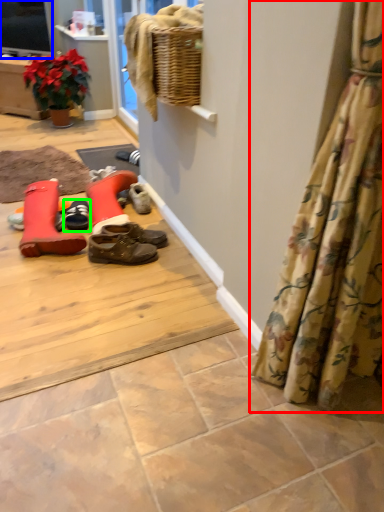
Question: Considering the real-world distances, which object is farthest from curtain (highlighted by a red box)? television (highlighted by a blue box) or footwear (highlighted by a green box)?

Choices:
 (A) television
 (B) footwear

Answer: (A)